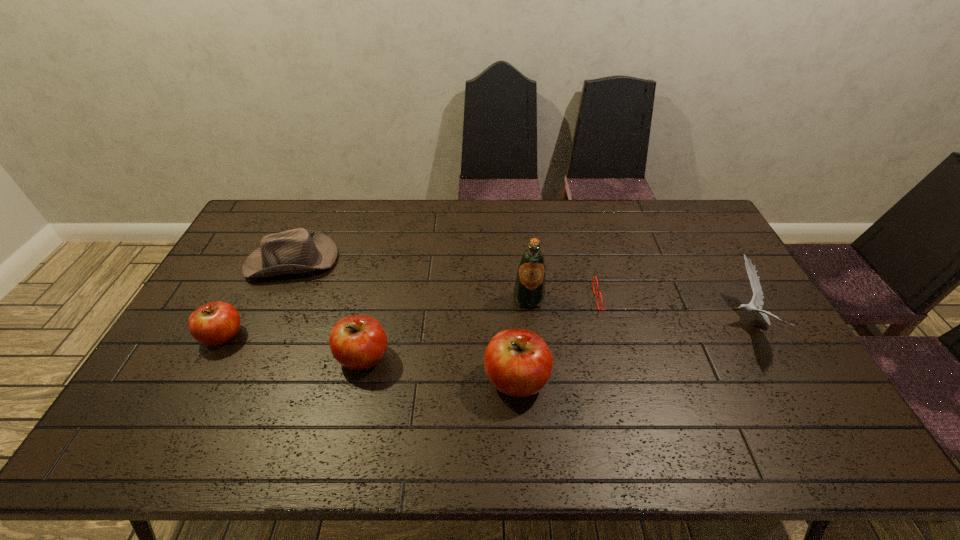
Identify the location of vacant space that's between the shortest apple and the second tallest apple. The width and height of the screenshot is (960, 540). (293, 346).

This screenshot has height=540, width=960. I want to click on vacant area that lies between the spectacles and the rightmost object, so click(x=683, y=310).

Where is `free space between the second tallest apple and the fedora`? free space between the second tallest apple and the fedora is located at coordinates (328, 308).

Where is `free point between the rightmost object and the spectacles`? The image size is (960, 540). free point between the rightmost object and the spectacles is located at coordinates [683, 310].

This screenshot has width=960, height=540. What are the coordinates of `free space between the second apple from right to left and the rightmost apple` in the screenshot? It's located at (440, 368).

You are a GUI agent. You are given a task and a screenshot of the screen. Output one action in this format:
    pyautogui.click(x=<x>, y=<y>)
    Task: Click on the free spot between the rightmost object and the sixth object from left to right
    This screenshot has height=540, width=960.
    Given the screenshot: What is the action you would take?
    pyautogui.click(x=683, y=310)

The height and width of the screenshot is (540, 960). In order to click on free spot between the fedora and the rightmost apple in this screenshot , I will do [x=404, y=320].

Where is `object that is the fifth closest to the rightmost object`? object that is the fifth closest to the rightmost object is located at coordinates (298, 250).

Find the location of `object that stands as the third closest to the second shortest apple`. object that stands as the third closest to the second shortest apple is located at coordinates (214, 323).

Where is `apple identified as the third closest to the tallest object`? apple identified as the third closest to the tallest object is located at coordinates (214, 323).